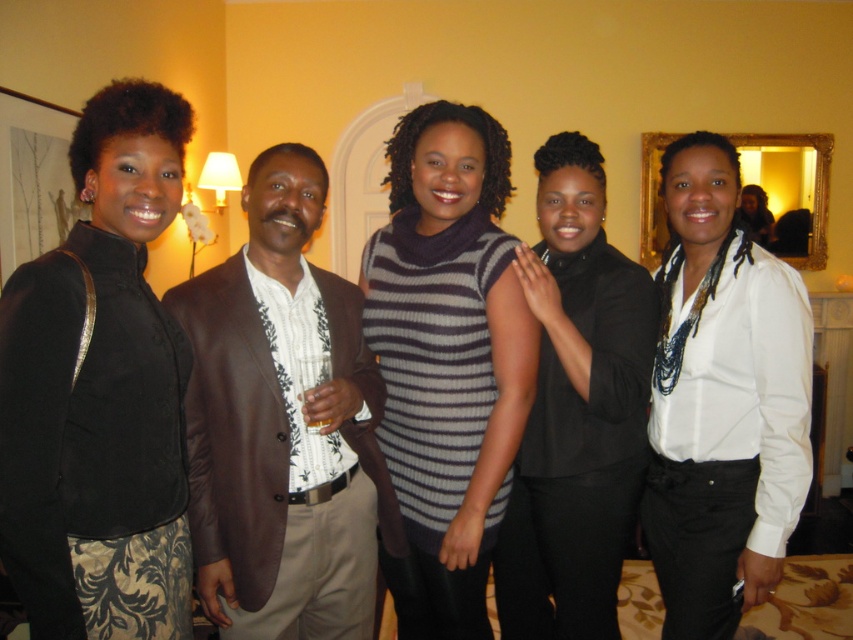
You are standing in the room and want to hand a drink to the person wearing the black velvet jacket at left and the white silk blouse at center. Which one can you reach without moving closer?

The black velvet jacket at left is closer to the viewer than the white silk blouse at center, so you can reach the person wearing the black velvet jacket at left without moving closer.

You are standing in the room and want to hand a coat hanger to the person wearing the black velvet jacket at left. Based on their position, which direction should you walk to reach them?

The black velvet jacket at left is located at point (x=100, y=392) in the image, so you should walk towards the left side of the room to reach the person wearing it.

You are planning to take a photo of the group and want to ensure that both the black velvet jacket at left and the striped knit dress at center are clearly visible. Based on their positions, which one might naturally be more in focus if you focus on the frontmost subject?

The black velvet jacket at left is in front of the striped knit dress at center, so focusing on the frontmost subject would naturally put the black velvet jacket at left in focus while the striped knit dress at center may appear slightly out of focus.